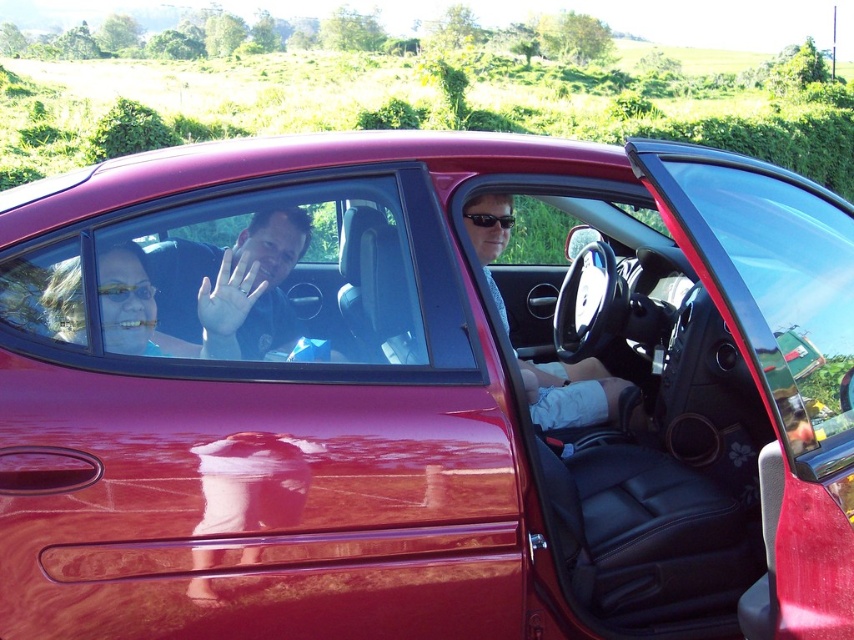
Between point (806, 436) and point (290, 241), which one is positioned behind?

Point (290, 241)

Is transparent glass door at center to the right of matte blue shirt at center from the viewer's perspective?

Indeed, transparent glass door at center is positioned on the right side of matte blue shirt at center.

Does point (736, 340) come behind point (268, 282)?

No, (736, 340) is in front of (268, 282).

In order to click on transparent glass door at center in this screenshot , I will do `click(770, 284)`.

Does matte blue shirt at center have a greater width compared to black plastic sunglasses at center?

Yes, matte blue shirt at center is wider than black plastic sunglasses at center.

Is point (197, 339) in front of point (500, 225)?

Yes, it is in front of point (500, 225).

Where is `matte blue shirt at center`? matte blue shirt at center is located at coordinates (231, 288).

Between satin black shirt at center and gold reflective goggles at center, which one is positioned higher?

Positioned higher is gold reflective goggles at center.

Can you confirm if satin black shirt at center is shorter than gold reflective goggles at center?

Incorrect, satin black shirt at center's height does not fall short of gold reflective goggles at center's.

Where is `satin black shirt at center`? The height and width of the screenshot is (640, 854). satin black shirt at center is located at coordinates (571, 394).